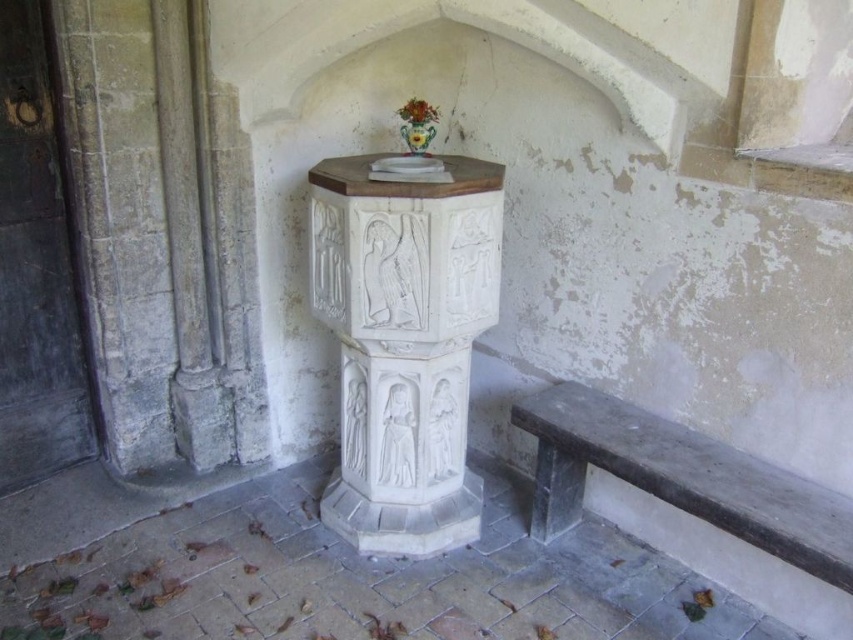
Does smooth gray bench at lower right have a lesser height compared to green glazed vase at center?

In fact, smooth gray bench at lower right may be taller than green glazed vase at center.

Can you confirm if smooth gray bench at lower right is positioned to the right of green glazed vase at center?

Correct, you'll find smooth gray bench at lower right to the right of green glazed vase at center.

What do you see at coordinates (679, 477) in the screenshot? The width and height of the screenshot is (853, 640). I see `smooth gray bench at lower right` at bounding box center [679, 477].

Locate an element on the screen. The image size is (853, 640). smooth gray bench at lower right is located at coordinates (679, 477).

Does white stone baptismal font at center have a greater width compared to green glazed vase at center?

Indeed, white stone baptismal font at center has a greater width compared to green glazed vase at center.

Identify the location of white stone baptismal font at center. (404, 342).

What are the coordinates of `white stone baptismal font at center` in the screenshot? It's located at (404, 342).

Is smooth gray bench at lower right further to the viewer compared to porcelain vase at upper center?

No, smooth gray bench at lower right is in front of porcelain vase at upper center.

Looking at this image, is smooth gray bench at lower right closer to the viewer compared to porcelain vase at upper center?

Yes, it is in front of porcelain vase at upper center.

Which is in front, point (766, 531) or point (410, 120)?

Point (766, 531)

Where is `smooth gray bench at lower right`? smooth gray bench at lower right is located at coordinates (679, 477).